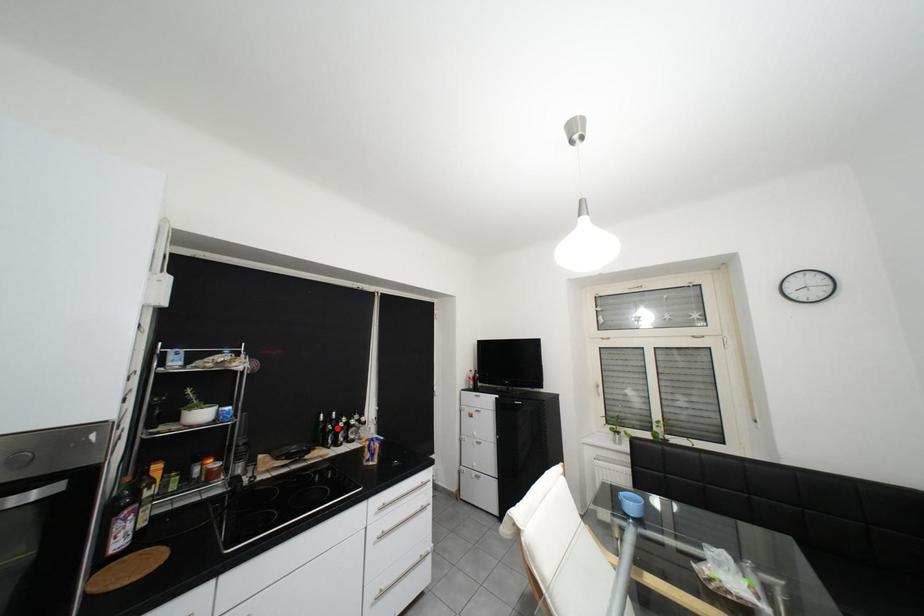
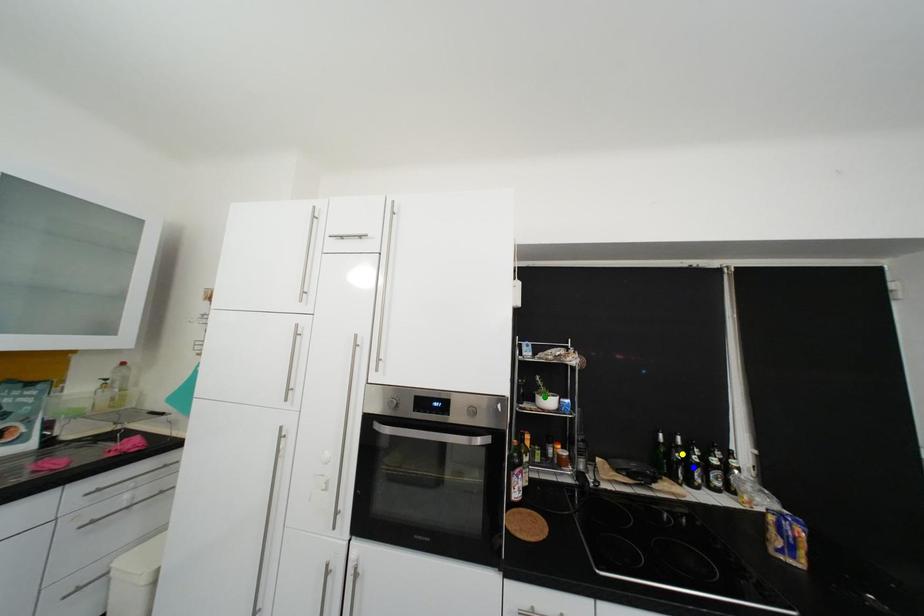
Question: I am providing you with two images of the same scene from different viewpoints. A red point is marked on the first image. You are given multiple points on the second image. Can you choose the point in image 2 that corresponds to the point in image 1?

Choices:
 (A) blue point
 (B) green point
 (C) yellow point

Answer: (C)